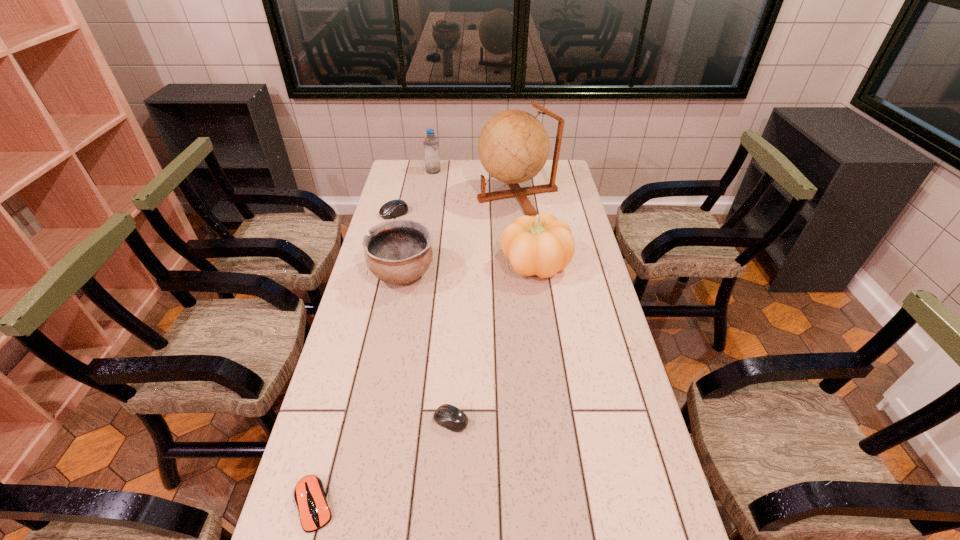
Find the location of a particular element. This screenshot has width=960, height=540. free spot that satisfies the following two spatial constraints: 1. on the front side of the pumpkin; 2. on the right side of the left black mouse is located at coordinates [x=381, y=264].

Where is `vacant space that satisfies the following two spatial constraints: 1. on the back side of the shortest computer mouse; 2. on the right side of the blue water bottle`? The width and height of the screenshot is (960, 540). vacant space that satisfies the following two spatial constraints: 1. on the back side of the shortest computer mouse; 2. on the right side of the blue water bottle is located at coordinates 402,171.